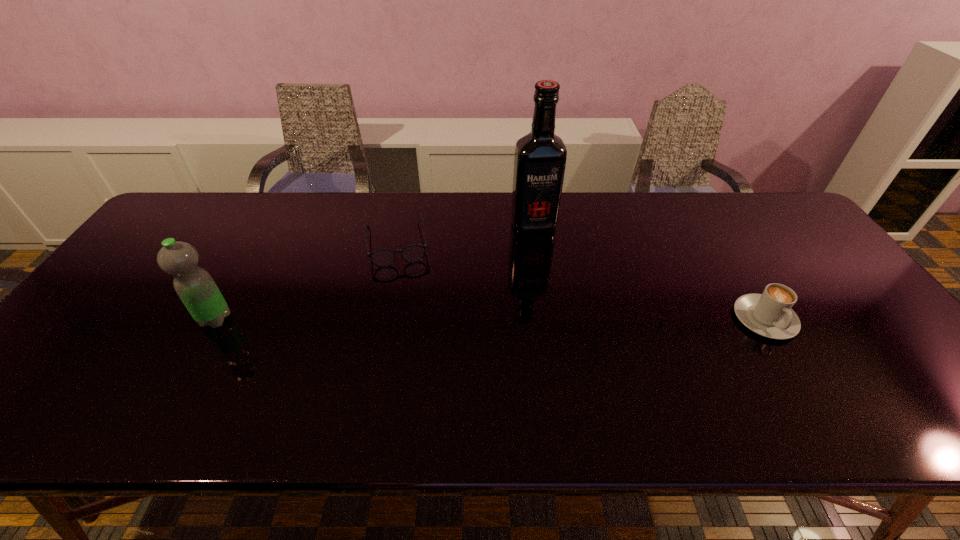
Locate an element on the screen. Image resolution: width=960 pixels, height=540 pixels. empty space that is in between the third tallest object and the spectacles is located at coordinates (581, 281).

Image resolution: width=960 pixels, height=540 pixels. What are the coordinates of `free spot between the water bottle and the liquor` in the screenshot? It's located at (374, 272).

Where is `vacant area that lies between the second shortest object and the water bottle`? vacant area that lies between the second shortest object and the water bottle is located at coordinates (490, 319).

This screenshot has width=960, height=540. I want to click on blank region between the shortest object and the third object from left to right, so click(466, 235).

Point out which object is positioned as the nearest to the cappuccino. Please provide its 2D coordinates. Your answer should be formatted as a tuple, i.e. [(x, y)], where the tuple contains the x and y coordinates of a point satisfying the conditions above.

[(540, 157)]

Locate which object is the second closest to the rightmost object. Please provide its 2D coordinates. Your answer should be formatted as a tuple, i.e. [(x, y)], where the tuple contains the x and y coordinates of a point satisfying the conditions above.

[(413, 253)]